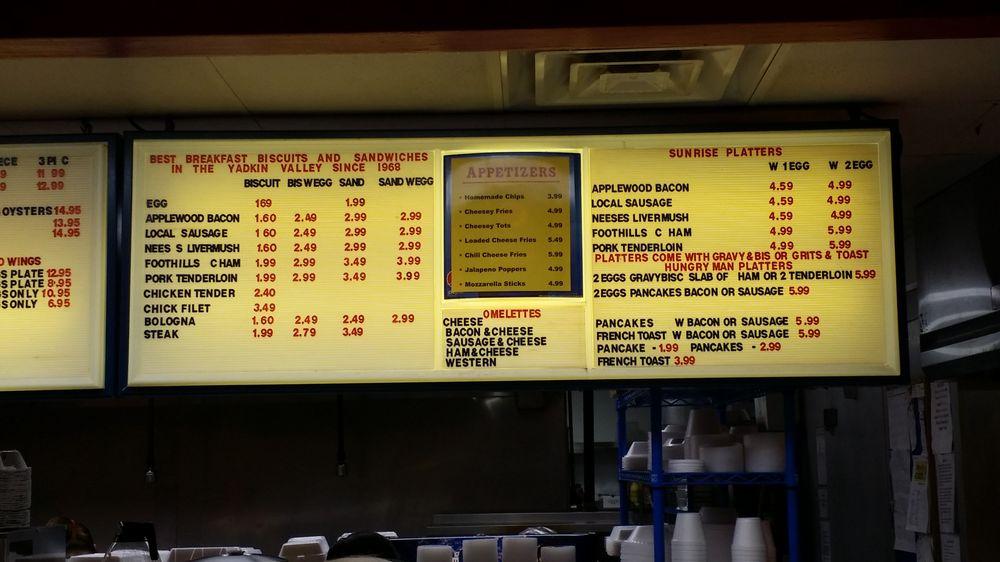
Locate an element on the screen. The width and height of the screenshot is (1000, 562). ceiling vent is located at coordinates pos(634,76).